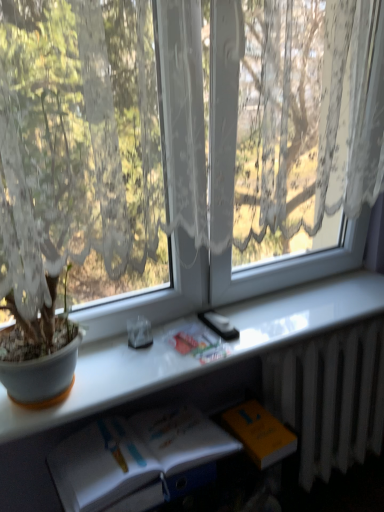
Where is `empty space that is ontop of white glossy book at lower center (from a real-world perspective)`? The width and height of the screenshot is (384, 512). empty space that is ontop of white glossy book at lower center (from a real-world perspective) is located at coordinates pos(250,321).